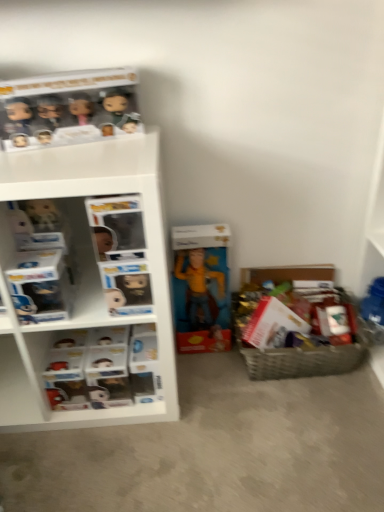
Locate an element on the screen. free location to the right of white plastic shelf at left is located at coordinates click(238, 421).